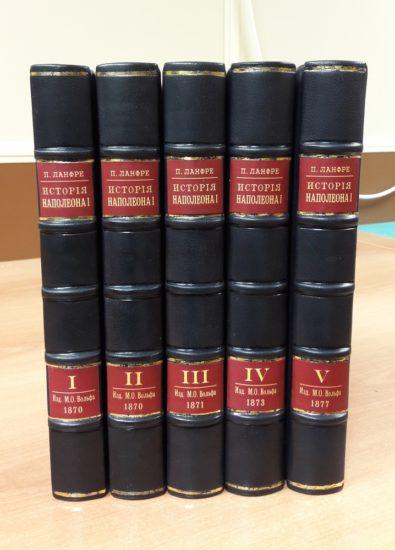
In order to click on brown paint in this screenshot , I will do `click(21, 205)`, `click(378, 170)`.